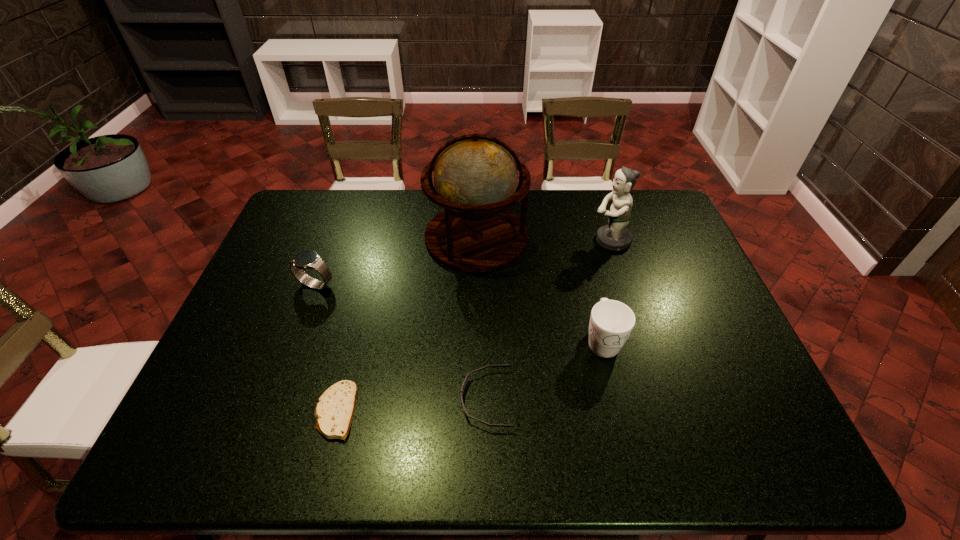
The height and width of the screenshot is (540, 960). Identify the location of sunglasses positioned at the near edge. (465, 412).

The height and width of the screenshot is (540, 960). Identify the location of pita bread that is at the near edge. (334, 411).

The width and height of the screenshot is (960, 540). Identify the location of object located at the left edge. (308, 259).

In the image, there is a desktop. What are the coordinates of `vacant space at the far edge` in the screenshot? It's located at (601, 226).

This screenshot has width=960, height=540. I want to click on vacant space at the near edge, so click(510, 431).

The height and width of the screenshot is (540, 960). In order to click on free space at the left edge of the desktop in this screenshot , I will do click(277, 303).

In the image, there is a desktop. Where is `vacant space at the right edge`? The width and height of the screenshot is (960, 540). vacant space at the right edge is located at coordinates (678, 292).

Image resolution: width=960 pixels, height=540 pixels. In the image, there is a desktop. What are the coordinates of `vacant area at the far left corner` in the screenshot? It's located at (327, 199).

In order to click on vacant space at the near left corner of the desktop in this screenshot , I will do `click(228, 453)`.

You are a GUI agent. You are given a task and a screenshot of the screen. Output one action in this format:
    pyautogui.click(x=<x>, y=<y>)
    Task: Click on the unoccupied area between the tallest object and the fourth farthest object
    This screenshot has width=960, height=540.
    Given the screenshot: What is the action you would take?
    pyautogui.click(x=540, y=289)